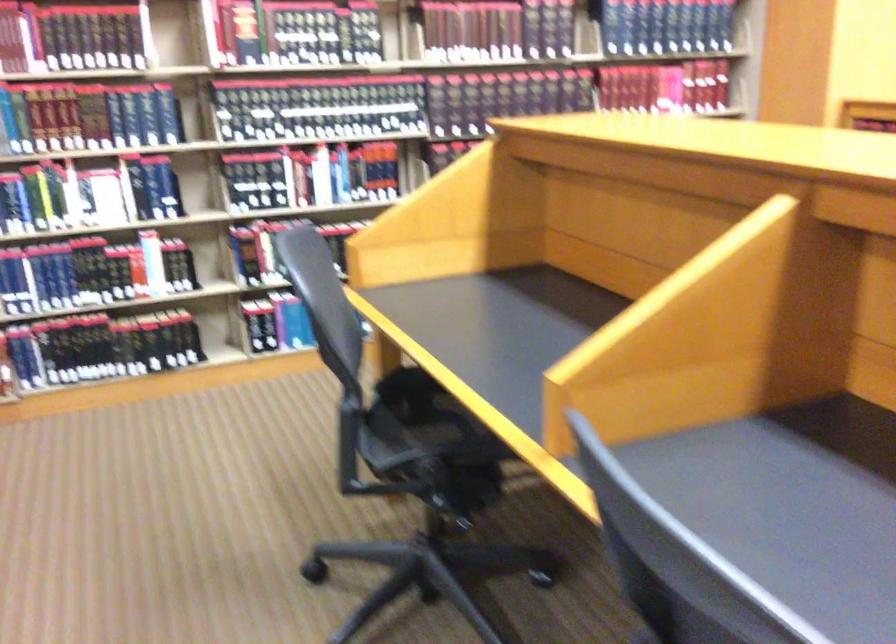
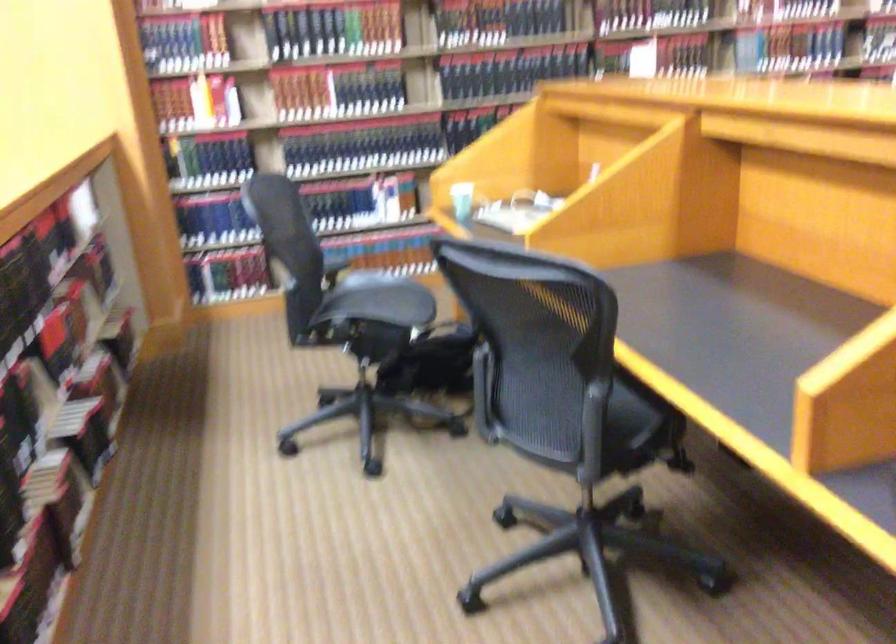
Based on the photo, in a continuous first-person perspective shot, in which direction is the camera moving?

The cameraman moved toward left, backward.